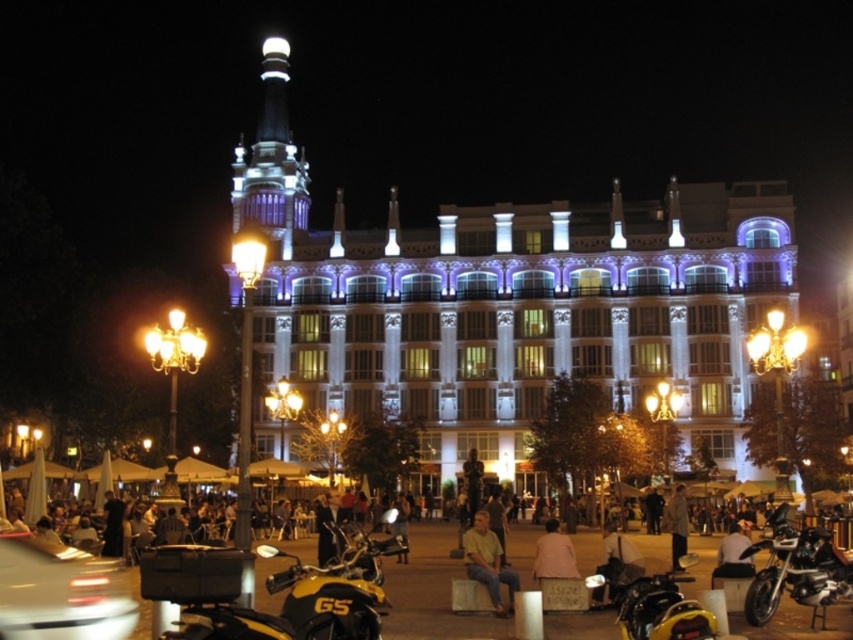
Is yellow matte motorcycle at lower left smaller than shiny black motorcycle at lower right?

No.

Looking at this image, who is positioned more to the right, yellow matte motorcycle at lower left or shiny black motorcycle at lower right?

shiny black motorcycle at lower right is more to the right.

This screenshot has width=853, height=640. Describe the element at coordinates (267, 593) in the screenshot. I see `yellow matte motorcycle at lower left` at that location.

Find the location of a particular element. yellow matte motorcycle at lower left is located at coordinates (267, 593).

Does shiny black motorcycle at lower right have a larger size compared to light brown fabric shirt at center?

Yes.

Find the location of a particular element. Image resolution: width=853 pixels, height=640 pixels. shiny black motorcycle at lower right is located at coordinates (796, 570).

Does yellow matte motorcycle at lower left appear under light brown fabric shirt at center?

Correct, yellow matte motorcycle at lower left is located below light brown fabric shirt at center.

Does yellow matte motorcycle at lower left have a smaller size compared to light brown fabric shirt at center?

Actually, yellow matte motorcycle at lower left might be larger than light brown fabric shirt at center.

The height and width of the screenshot is (640, 853). What do you see at coordinates (267, 593) in the screenshot? I see `yellow matte motorcycle at lower left` at bounding box center [267, 593].

The width and height of the screenshot is (853, 640). Find the location of `yellow matte motorcycle at lower left`. yellow matte motorcycle at lower left is located at coordinates (267, 593).